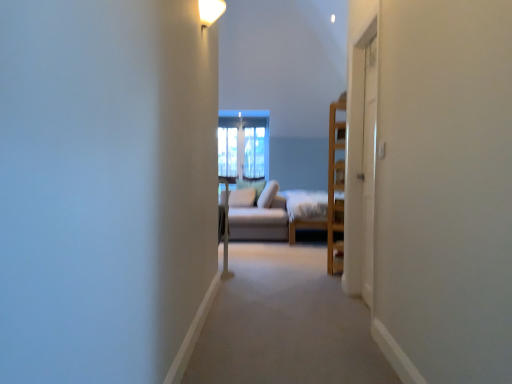
Question: Does light brown wooden bed frame at center have a lesser width compared to white glossy light fixture at upper center?

Choices:
 (A) yes
 (B) no

Answer: (B)

Question: Can you confirm if light brown wooden bed frame at center is taller than white glossy light fixture at upper center?

Choices:
 (A) no
 (B) yes

Answer: (B)

Question: From the image's perspective, does light brown wooden bed frame at center appear lower than white glossy light fixture at upper center?

Choices:
 (A) yes
 (B) no

Answer: (A)

Question: Is light brown wooden bed frame at center further to the viewer compared to white glossy light fixture at upper center?

Choices:
 (A) yes
 (B) no

Answer: (A)

Question: Does light brown wooden bed frame at center have a greater width compared to white glossy light fixture at upper center?

Choices:
 (A) no
 (B) yes

Answer: (B)

Question: Is point (257, 127) closer or farther from the camera than point (367, 99)?

Choices:
 (A) closer
 (B) farther

Answer: (B)

Question: Considering the positions of clear glass window at center and white wood screen door at right, acting as the first screen door starting from the right, in the image, is clear glass window at center taller or shorter than white wood screen door at right, acting as the first screen door starting from the right,?

Choices:
 (A) short
 (B) tall

Answer: (A)

Question: In terms of width, does clear glass window at center look wider or thinner when compared to white wood screen door at right, which is the second screen door in left-to-right order?

Choices:
 (A) wide
 (B) thin

Answer: (B)

Question: Visually, is clear glass window at center positioned to the left or to the right of white wood screen door at right, which is the second screen door in left-to-right order?

Choices:
 (A) right
 (B) left

Answer: (B)

Question: Considering the positions of light brown wooden bed frame at center and white glossy light fixture at upper center in the image, is light brown wooden bed frame at center bigger or smaller than white glossy light fixture at upper center?

Choices:
 (A) big
 (B) small

Answer: (A)

Question: Relative to white glossy light fixture at upper center, is light brown wooden bed frame at center in front or behind?

Choices:
 (A) front
 (B) behind

Answer: (B)

Question: From the image's perspective, is light brown wooden bed frame at center positioned above or below white glossy light fixture at upper center?

Choices:
 (A) above
 (B) below

Answer: (B)

Question: From a real-world perspective, is light brown wooden bed frame at center positioned above or below white glossy light fixture at upper center?

Choices:
 (A) below
 (B) above

Answer: (A)

Question: From their relative heights in the image, would you say clear glass window at center is taller or shorter than white glossy light fixture at upper center?

Choices:
 (A) short
 (B) tall

Answer: (B)

Question: Considering their positions, is clear glass window at center located in front of or behind white glossy light fixture at upper center?

Choices:
 (A) behind
 (B) front

Answer: (A)